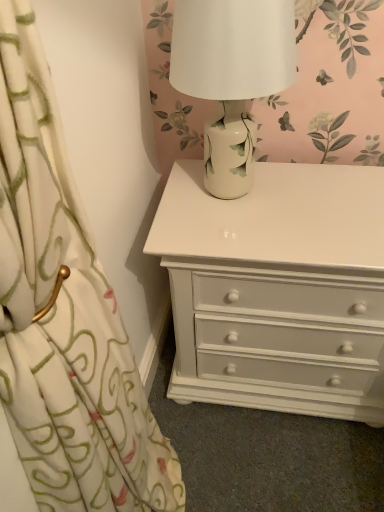
The height and width of the screenshot is (512, 384). In order to click on free point below white ceramic lamp at upper center (from a real-world perspective) in this screenshot , I will do `click(240, 195)`.